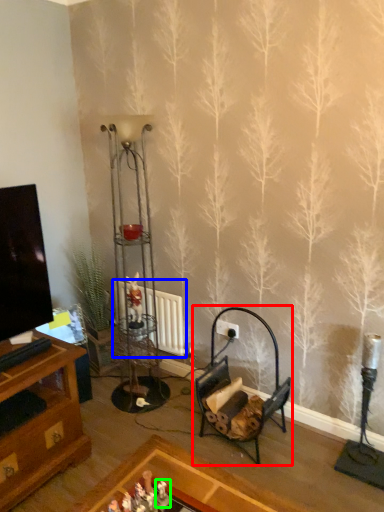
Question: Which is nearer to the rocking chair (highlighted by a red box)? radiator (highlighted by a blue box) or toy (highlighted by a green box).

Choices:
 (A) radiator
 (B) toy

Answer: (A)